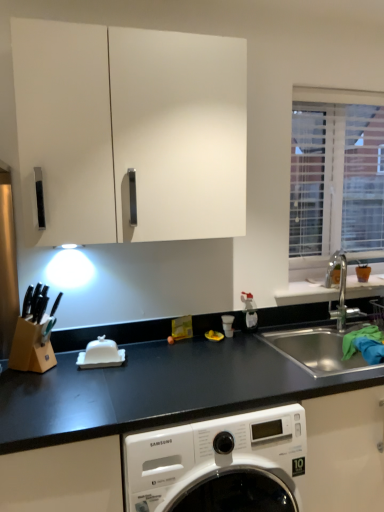
Question: Is point (327, 237) positioned closer to the camera than point (59, 392)?

Choices:
 (A) closer
 (B) farther

Answer: (B)

Question: In terms of width, does white blinds at upper right look wider or thinner when compared to black matte countertop at lower center?

Choices:
 (A) wide
 (B) thin

Answer: (B)

Question: Based on their relative distances, which object is nearer to the white glossy butter dish at center?

Choices:
 (A) white blinds at upper right
 (B) white glossy cabinet at upper center
 (C) stainless steel sink at right
 (D) white matte window sill at right
 (E) black matte countertop at lower center

Answer: (E)

Question: Considering the real-world distances, which object is farthest from the white glossy butter dish at center?

Choices:
 (A) stainless steel sink at right
 (B) white glossy cabinet at upper center
 (C) white matte window sill at right
 (D) black matte countertop at lower center
 (E) white blinds at upper right

Answer: (E)